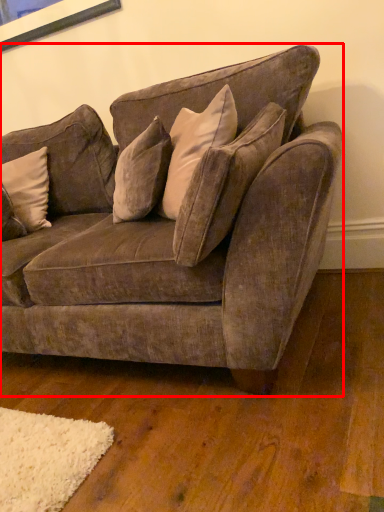
Question: From the image's perspective, what is the correct spatial positioning of studio couch (annotated by the red box) in reference to pillow?

Choices:
 (A) below
 (B) above

Answer: (A)